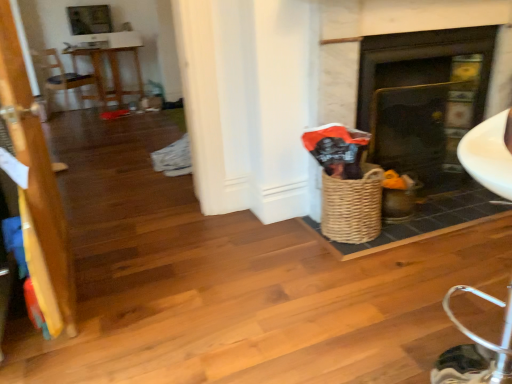
Where is `unoccupied area in front of wooden door at left`? This screenshot has height=384, width=512. unoccupied area in front of wooden door at left is located at coordinates (66, 344).